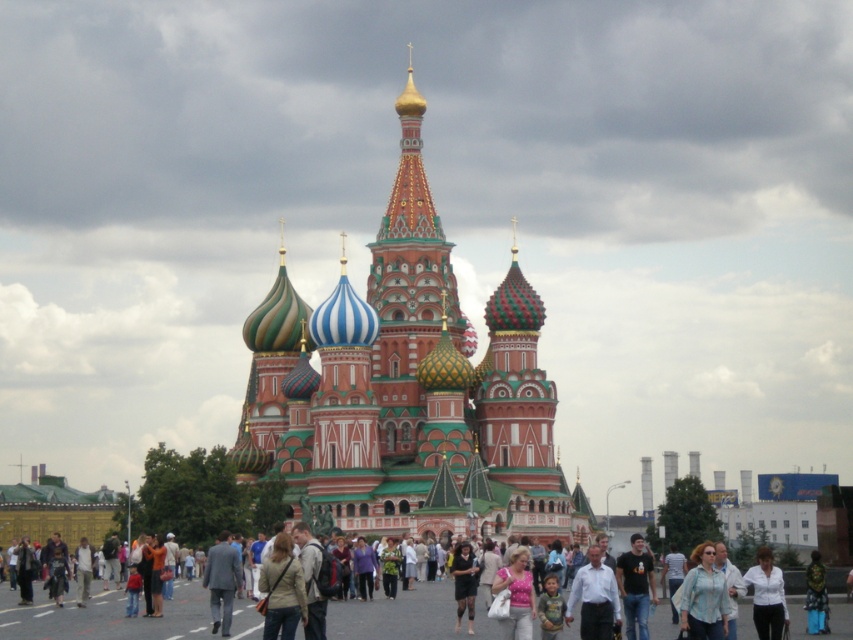
You are a photographer positioned at the edge of Red Square, Moscow, aiming to capture the Saint Basil Cathedral in the background. You notice two individuals in the foreground wearing a light beige jacket at center and a white matte shirt at center. To ensure both subjects are framed symmetrically with the cathedral as the central focus, which clothing item should you position closer to the left side of your camera frame?

The light beige jacket at center should be positioned closer to the left side of the camera frame since it is already located to the left of the white matte shirt at center, allowing for symmetrical framing with the cathedral as the central focus.

You are a photographer standing in Red Square, Moscow, and you want to capture a photo that includes both the multicolored mosaic dome at center and the white matte shirt at center. Considering their sizes, which object should you focus on to ensure both are clearly visible in the frame?

The multicolored mosaic dome at center is wider than the white matte shirt at center, so focusing on the dome will allow both objects to be clearly visible in the frame since it occupies more space.

You are standing at the bottom left corner of Red Square and want to find the light beige jacket at center. In which direction should you walk to reach it?

The light beige jacket at center is located at point (282, 589) in 2D coordinates, which is to the right and slightly above your current position at the bottom left corner. You should walk towards the right and upward direction to reach it.